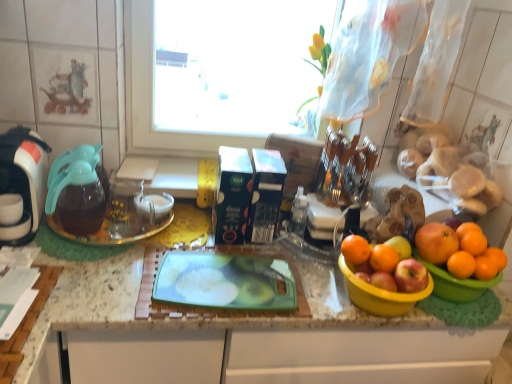
The width and height of the screenshot is (512, 384). In order to click on free point above green plastic cutting board at center (from a real-world perspective) in this screenshot , I will do `click(170, 275)`.